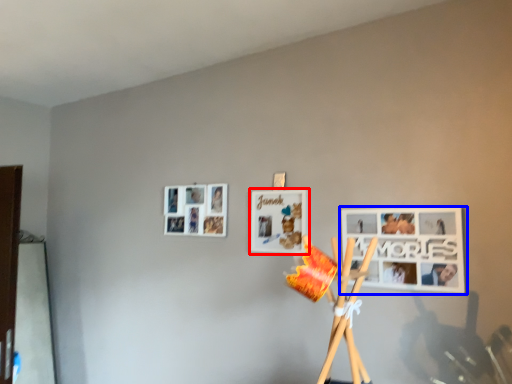
Question: Which object is further to the camera taking this photo, picture frame (highlighted by a red box) or picture frame (highlighted by a blue box)?

Choices:
 (A) picture frame
 (B) picture frame

Answer: (A)